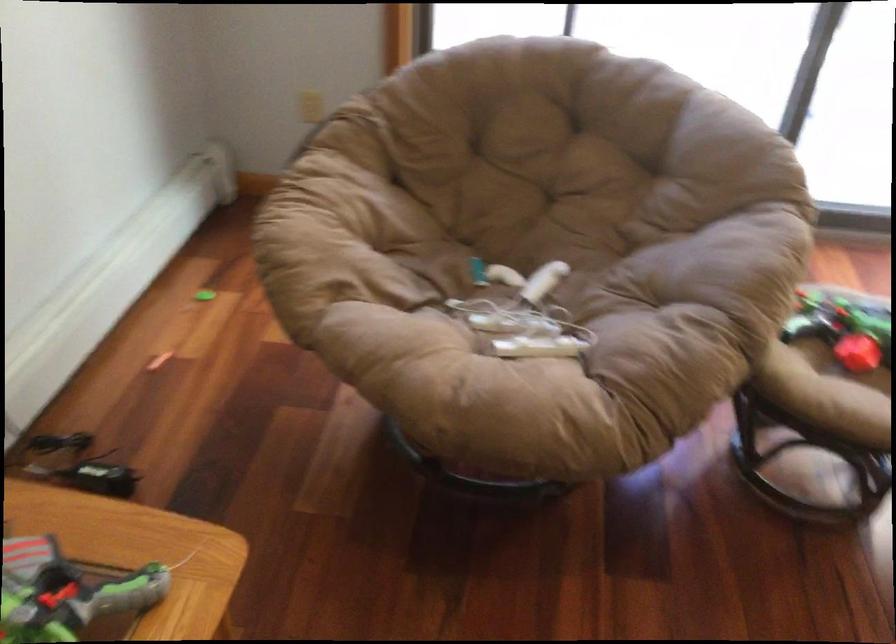
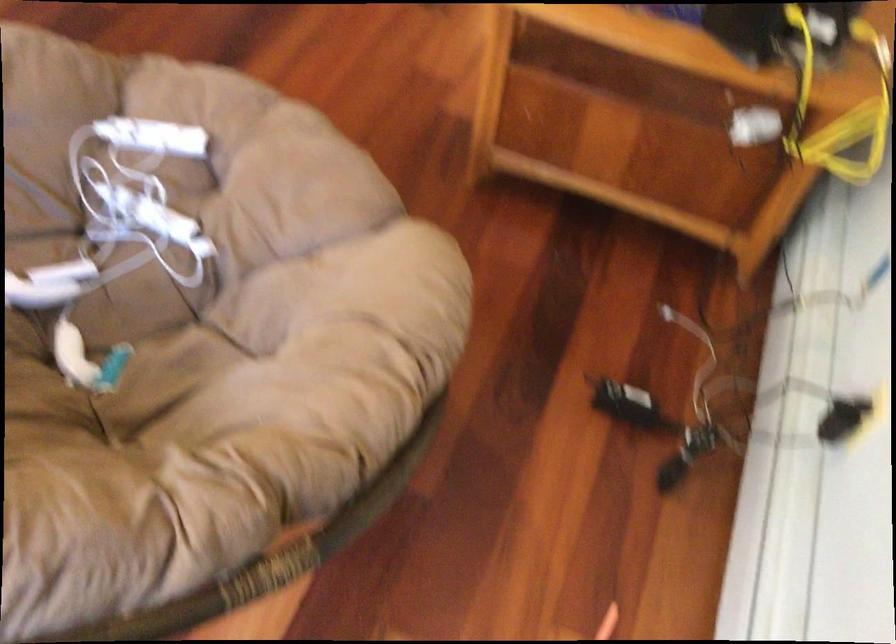
The point at (497,333) is marked in the first image. Where is the corresponding point in the second image?

(181, 205)